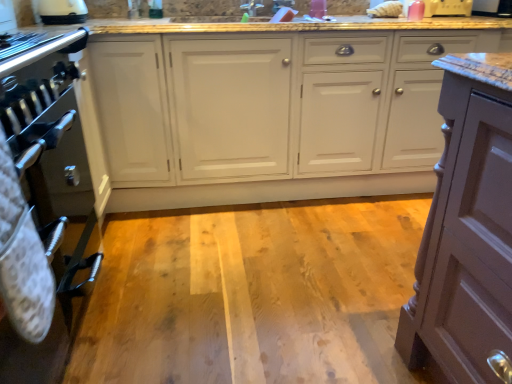
Question: Is black glossy microwave at upper right, which is the second appliance from left to right, in front of or behind white glossy cabinets at center in the image?

Choices:
 (A) behind
 (B) front

Answer: (A)

Question: Visually, is black glossy microwave at upper right, which is the second appliance from left to right, positioned to the left or to the right of white glossy cabinets at center?

Choices:
 (A) right
 (B) left

Answer: (A)

Question: Which object is positioned farthest from the wooden floor at center?

Choices:
 (A) white glossy kettle at upper left
 (B) metallic oven at left
 (C) white glossy faucet at upper center
 (D) white glossy cabinets at center
 (E) black glossy microwave at upper right, the 1th appliance in the right-to-left sequence

Answer: (E)

Question: Which of these objects is positioned farthest from the wooden floor at center?

Choices:
 (A) pink plastic toaster at upper right, positioned as the 2th appliance in right-to-left order
 (B) white glossy faucet at upper center
 (C) white glossy kettle at upper left
 (D) white glossy cabinets at center
 (E) black glossy microwave at upper right, the 1th appliance in the right-to-left sequence

Answer: (E)